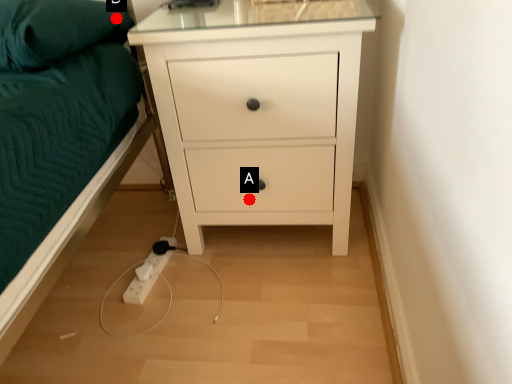
Question: Two points are circled on the image, labeled by A and B beside each circle. Which point is closer to the camera?

Choices:
 (A) A is closer
 (B) B is closer

Answer: (B)